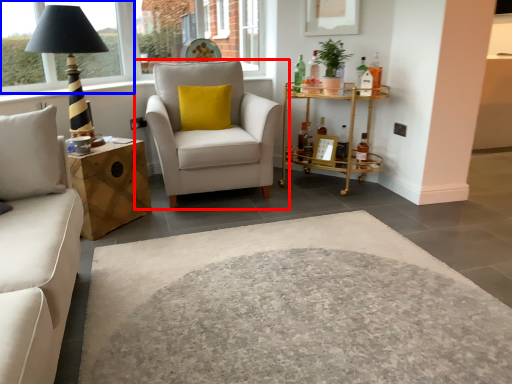
Question: Which object appears farthest to the camera in this image, chair (highlighted by a red box) or window frame (highlighted by a blue box)?

Choices:
 (A) chair
 (B) window frame

Answer: (B)